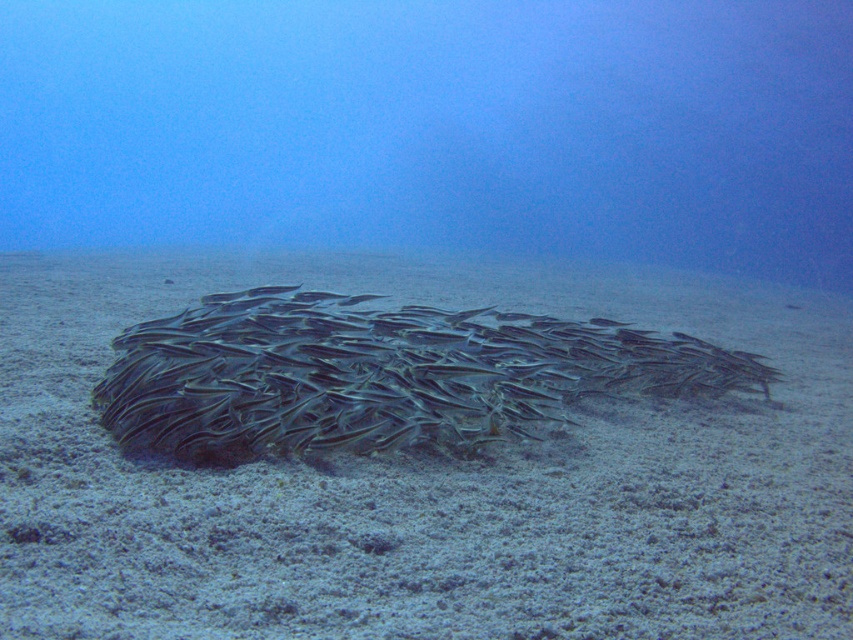
Who is more forward, (47, 531) or (312, 324)?

Point (47, 531) is in front.

Can you confirm if gray sandy bottom at center is shorter than silvery metallic fish at center?

Yes, gray sandy bottom at center is shorter than silvery metallic fish at center.

Is point (154, 282) positioned after point (410, 358)?

Yes, it is.

This screenshot has height=640, width=853. Identify the location of gray sandy bottom at center. (428, 477).